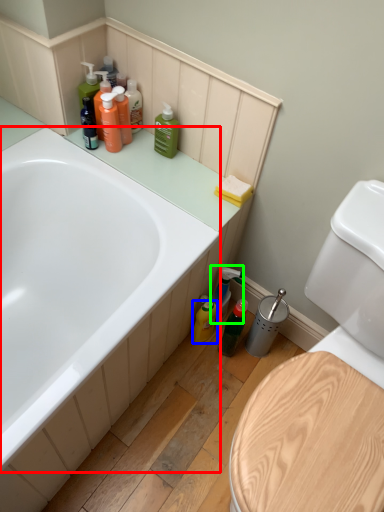
Question: Based on their relative distances, which object is nearer to bathtub (highlighted by a red box)? Choose from cleaning product (highlighted by a blue box) and cleaning product (highlighted by a green box).

Choices:
 (A) cleaning product
 (B) cleaning product

Answer: (B)